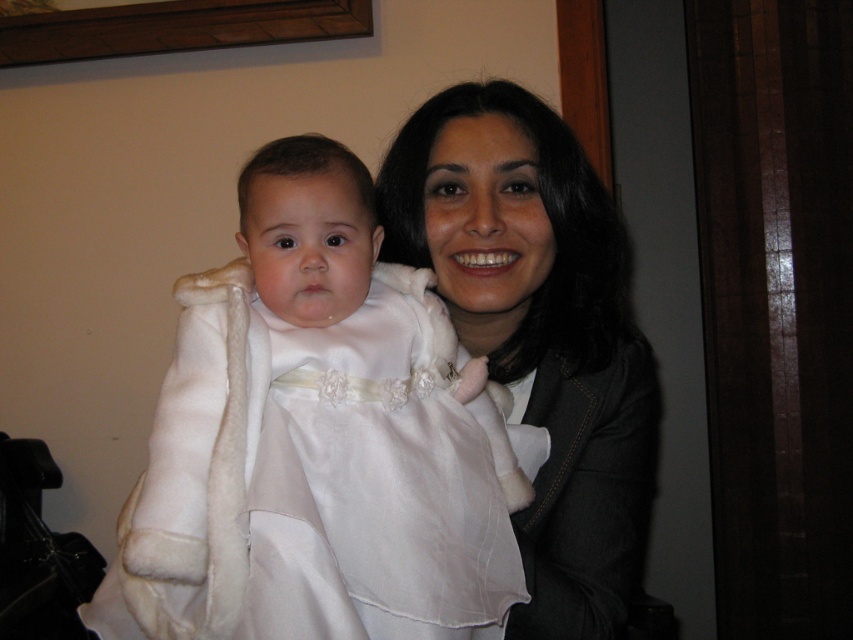
Question: Can you confirm if white satin dress at center is smaller than matte white coat at center?

Choices:
 (A) no
 (B) yes

Answer: (B)

Question: Which point appears farthest from the camera in this image?

Choices:
 (A) (482, 568)
 (B) (541, 108)

Answer: (B)

Question: Can you confirm if white satin dress at center is positioned to the right of matte white coat at center?

Choices:
 (A) no
 (B) yes

Answer: (A)

Question: Which point is farther from the camera taking this photo?

Choices:
 (A) (311, 592)
 (B) (386, 160)

Answer: (B)

Question: Which of the following is the farthest from the observer?

Choices:
 (A) click(x=184, y=349)
 (B) click(x=462, y=250)

Answer: (B)

Question: Can you confirm if white satin dress at center is positioned to the left of matte white coat at center?

Choices:
 (A) no
 (B) yes

Answer: (B)